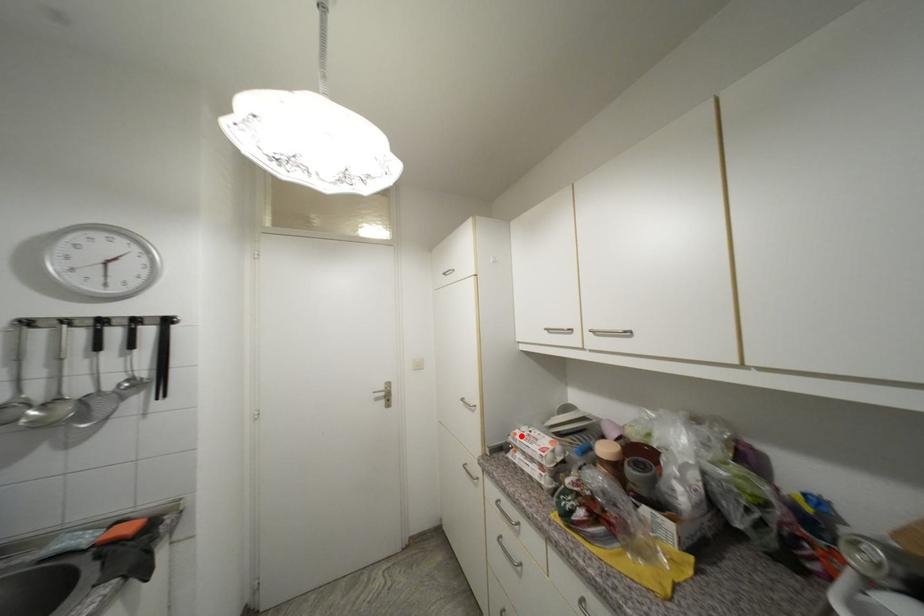
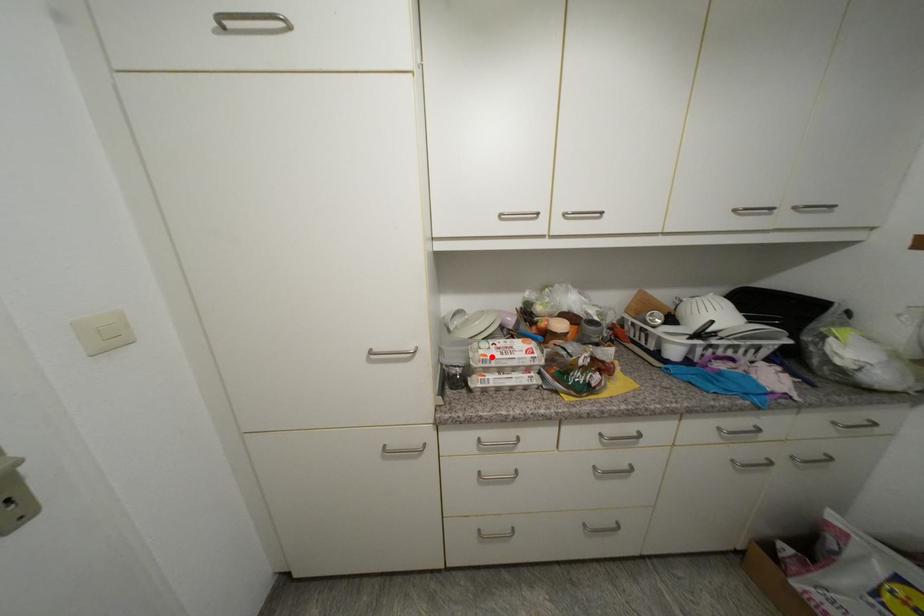
I am providing you with two images of the same scene from different viewpoints. A red point is marked on the first image and another point is marked on the second image. Are the points marked in image1 and image2 representing the same 3D position?

Yes